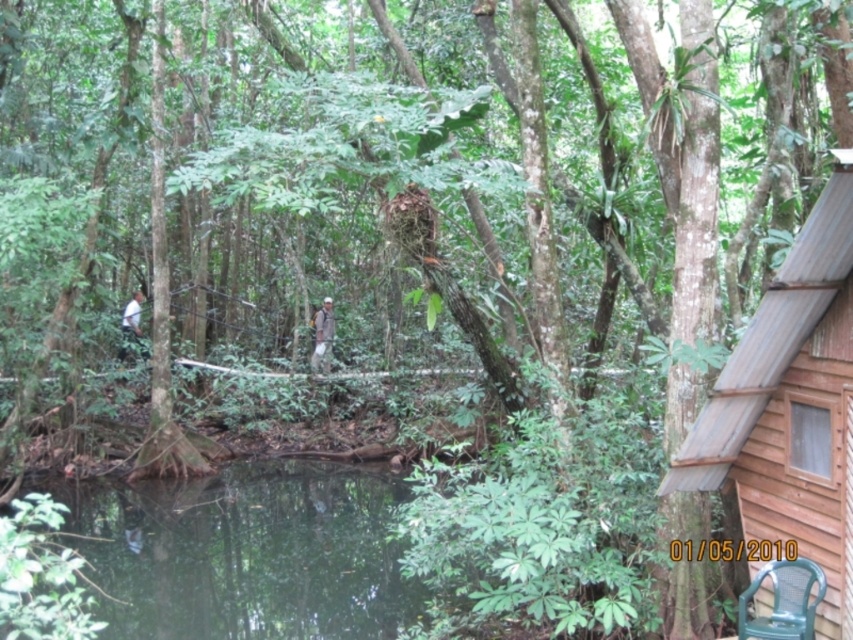
Who is lower down, brown wooden cabin at right or brown fabric backpack at center?

brown wooden cabin at right is below.

Does point (811, 392) come behind point (329, 314)?

No, it is not.

Image resolution: width=853 pixels, height=640 pixels. I want to click on brown wooden cabin at right, so click(x=791, y=404).

Does brown fabric backpack at center appear on the left side of white matte shirt at left?

No, brown fabric backpack at center is not to the left of white matte shirt at left.

Is point (328, 332) closer to viewer compared to point (138, 314)?

No, it is behind (138, 314).

Identify the location of brown fabric backpack at center. (322, 337).

Does brown wooden cabin at right appear on the left side of white matte shirt at left?

No, brown wooden cabin at right is not to the left of white matte shirt at left.

Can you confirm if brown wooden cabin at right is positioned below white matte shirt at left?

Indeed, brown wooden cabin at right is positioned under white matte shirt at left.

Between point (838, 522) and point (138, 317), which one is positioned in front?

Point (838, 522) is more forward.

What are the coordinates of `brown wooden cabin at right` in the screenshot? It's located at (791, 404).